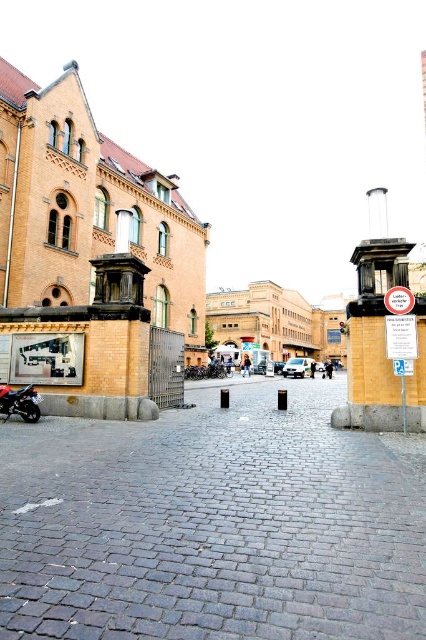
Does gray cobblestone pavement at center lie behind shiny red motorcycle at lower left?

That is False.

Is gray cobblestone pavement at center above shiny red motorcycle at lower left?

No.

Is point (180, 524) positioned behind point (8, 406)?

No.

Locate an element on the screen. The image size is (426, 640). gray cobblestone pavement at center is located at coordinates (213, 522).